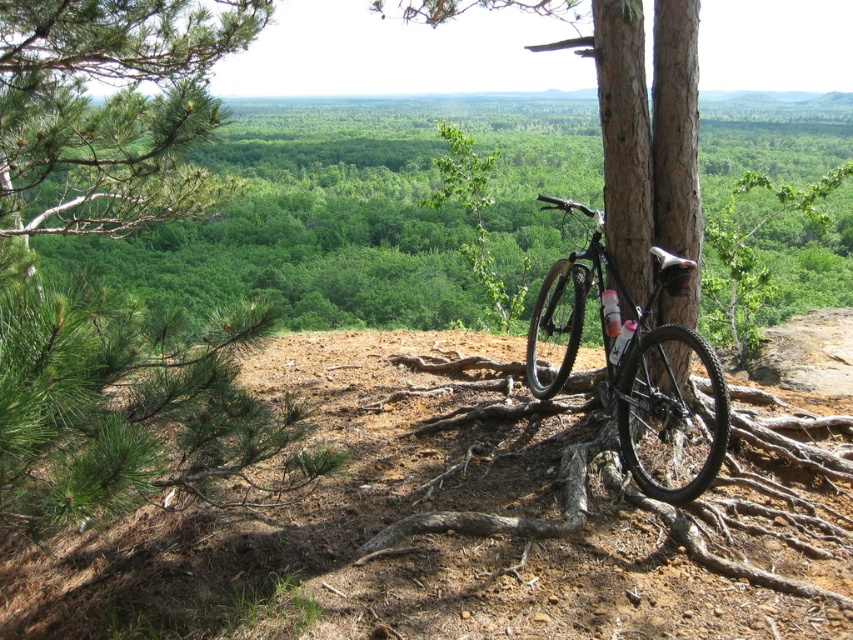
Question: Does green pine tree at upper left appear on the left side of matte black bicycle at center?

Choices:
 (A) yes
 (B) no

Answer: (A)

Question: Among these objects, which one is nearest to the camera?

Choices:
 (A) green pine tree at upper left
 (B) brown rough tree roots at center
 (C) matte black bicycle at center

Answer: (A)

Question: Among these points, which one is farthest from the camera?

Choices:
 (A) (561, 461)
 (B) (660, 403)
 (C) (349, 262)
 (D) (141, 429)

Answer: (C)

Question: Does matte black bicycle at center appear over brown rough tree roots at center?

Choices:
 (A) no
 (B) yes

Answer: (B)

Question: Which object is closer to the camera taking this photo?

Choices:
 (A) green pine tree at upper left
 (B) shiny black bicycle at center
 (C) matte black bicycle at center
 (D) brown rough tree roots at center

Answer: (A)

Question: Is shiny black bicycle at center bigger than brown rough tree roots at center?

Choices:
 (A) yes
 (B) no

Answer: (A)